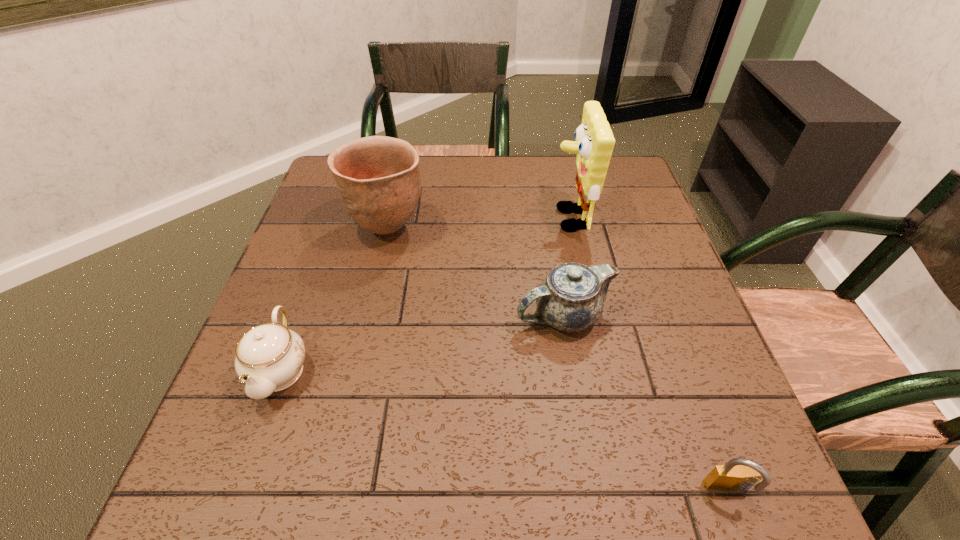
Locate an element on the screen. The height and width of the screenshot is (540, 960). the tallest object is located at coordinates (594, 144).

This screenshot has height=540, width=960. What are the coordinates of `pottery` in the screenshot? It's located at (378, 178).

Where is `the right chinaware`? Image resolution: width=960 pixels, height=540 pixels. the right chinaware is located at coordinates [x=571, y=298].

At what (x,y) coordinates should I click in order to perform the action: click on the left chinaware. Please return your answer as a coordinate pair (x, y). This screenshot has width=960, height=540. Looking at the image, I should click on (269, 357).

In order to click on the nearest object in this screenshot , I will do `click(737, 474)`.

Where is `padlock`? padlock is located at coordinates (737, 474).

This screenshot has height=540, width=960. I want to click on free space located 0.390m on the face of the sponge, so click(401, 219).

Image resolution: width=960 pixels, height=540 pixels. I want to click on vacant region located 0.090m on the face of the sponge, so click(516, 219).

The width and height of the screenshot is (960, 540). In order to click on vacant region located on the face of the sponge in this screenshot , I will do `click(459, 219)`.

I want to click on vacant space located 0.360m on the right of the pottery, so click(567, 229).